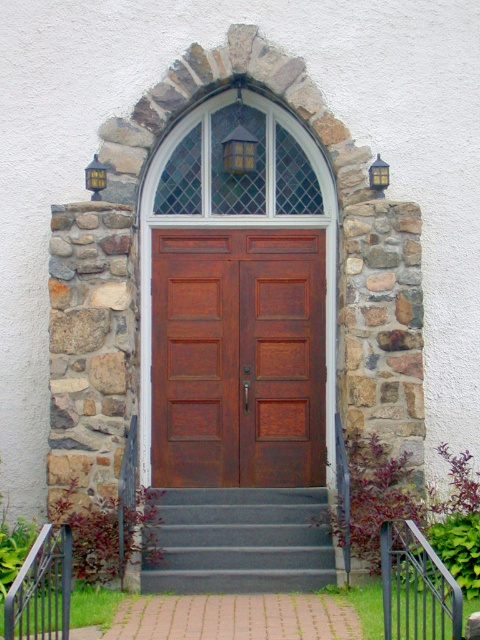
Who is shorter, gray carpeted stairs at center or black metal/rail at lower right?

With less height is gray carpeted stairs at center.

Based on the photo, can you confirm if gray carpeted stairs at center is positioned above black metal/rail at lower right?

Actually, gray carpeted stairs at center is below black metal/rail at lower right.

Who is more distant from viewer, (286, 552) or (422, 564)?

The point (286, 552) is more distant.

What are the coordinates of `gray carpeted stairs at center` in the screenshot? It's located at (241, 541).

Who is positioned more to the left, brown wooden door at center or gray carpeted stairs at center?

brown wooden door at center

Who is more distant from viewer, (190,481) or (292,500)?

The point (190,481) is behind.

Measure the distance between point (180,452) and camera.

A distance of 9.51 meters exists between point (180,452) and camera.

Locate an element on the screen. Image resolution: width=480 pixels, height=640 pixels. brown wooden door at center is located at coordinates (238, 356).

Is black metal/rail at lower right wider than black metal/rail at lower left?

Yes.

Does black metal/rail at lower right have a greater height compared to black metal/rail at lower left?

Yes, black metal/rail at lower right is taller than black metal/rail at lower left.

Does point (419, 564) come behind point (34, 564)?

Yes.

Locate an element on the screen. This screenshot has width=480, height=640. black metal/rail at lower right is located at coordinates (417, 586).